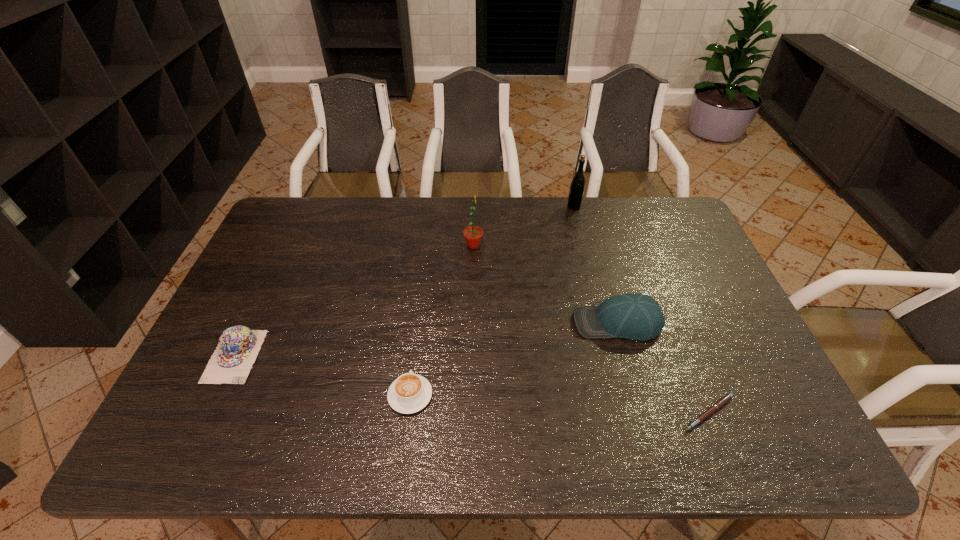
Locate an element on the screen. This screenshot has height=540, width=960. vacant space that satisfies the following two spatial constraints: 1. on the side of the cappuccino with the handle; 2. on the left side of the baseball cap is located at coordinates (x=420, y=323).

Find the location of a particular element. blank area in the image that satisfies the following two spatial constraints: 1. on the side of the beer bottle with the handle; 2. on the left side of the second object from left to right is located at coordinates point(434,207).

This screenshot has height=540, width=960. Identify the location of free space that satisfies the following two spatial constraints: 1. on the front side of the baseball cap; 2. on the left side of the farthest object. (604, 323).